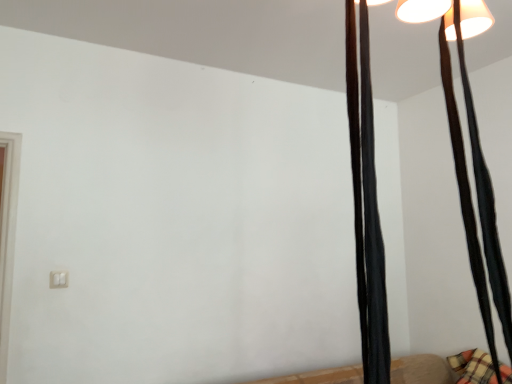
Question: Is black fabric curtain at upper right, the 1th curtain in the back-to-front sequence, spatially inside black fabric curtain at right, which is counted as the second curtain, starting from the right, or outside of it?

Choices:
 (A) inside
 (B) outside

Answer: (B)

Question: Considering the relative positions of black fabric curtain at upper right, which is counted as the 2th curtain, starting from the front, and black fabric curtain at right, which is the second curtain in back-to-front order, in the image provided, is black fabric curtain at upper right, which is counted as the 2th curtain, starting from the front, to the left or to the right of black fabric curtain at right, which is the second curtain in back-to-front order,?

Choices:
 (A) right
 (B) left

Answer: (A)

Question: Based on their sizes in the image, would you say black fabric curtain at upper right, which is counted as the 2th curtain, starting from the front, is bigger or smaller than black fabric curtain at right, which is the first curtain from left to right?

Choices:
 (A) big
 (B) small

Answer: (A)

Question: Is point (381, 345) closer or farther from the camera than point (501, 269)?

Choices:
 (A) farther
 (B) closer

Answer: (B)

Question: From their relative heights in the image, would you say black fabric curtain at right, which is the second curtain in back-to-front order, is taller or shorter than black fabric curtain at upper right, the 1th curtain in the back-to-front sequence?

Choices:
 (A) tall
 (B) short

Answer: (B)

Question: Is black fabric curtain at right, which is the first curtain from left to right, inside or outside of black fabric curtain at upper right, which is counted as the 2th curtain, starting from the front?

Choices:
 (A) inside
 (B) outside

Answer: (B)

Question: From a real-world perspective, is black fabric curtain at right, which is the 1th curtain from front to back, physically located above or below black fabric curtain at upper right, the 2th curtain viewed from the left?

Choices:
 (A) below
 (B) above

Answer: (A)